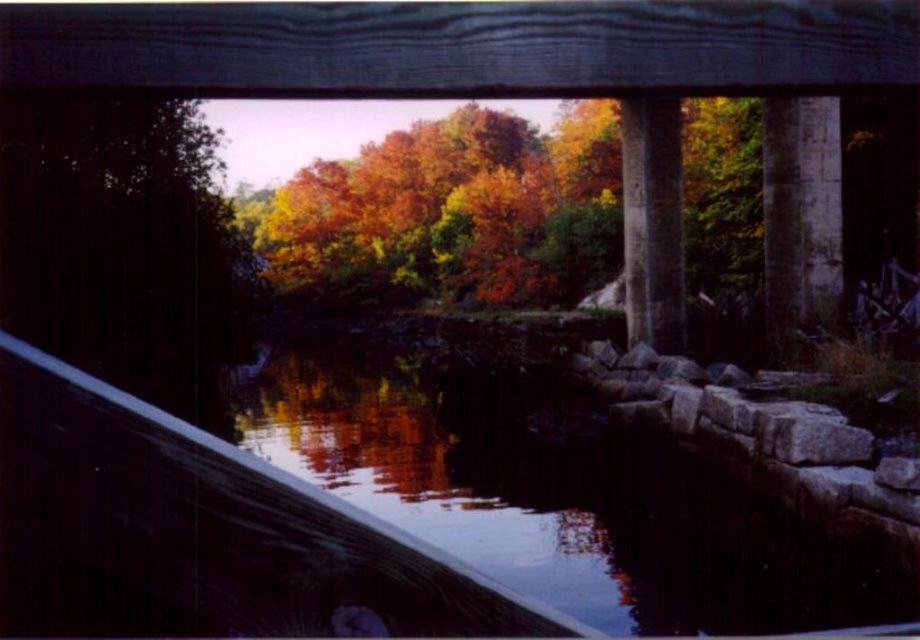
Is gray concrete pillar at right to the right of gray concrete pillar at center-right from the viewer's perspective?

Indeed, gray concrete pillar at right is positioned on the right side of gray concrete pillar at center-right.

Does gray concrete pillar at right have a lesser height compared to gray concrete pillar at center-right?

Yes, gray concrete pillar at right is shorter than gray concrete pillar at center-right.

Who is more forward, (820, 108) or (635, 104)?

Point (820, 108)

The width and height of the screenshot is (920, 640). In order to click on gray concrete pillar at right in this screenshot , I will do `click(800, 214)`.

Does point (628, 468) lie in front of point (818, 163)?

Yes, it is in front of point (818, 163).

Measure the distance between point (474,396) and camera.

27.33 meters

Locate an element on the screen. Image resolution: width=920 pixels, height=640 pixels. smooth stone river at center is located at coordinates (558, 500).

Can you confirm if smooth stone river at center is taller than gray concrete pillar at center-right?

No, smooth stone river at center is not taller than gray concrete pillar at center-right.

Is smooth stone river at center to the right of gray concrete pillar at center-right from the viewer's perspective?

In fact, smooth stone river at center is to the left of gray concrete pillar at center-right.

What are the coordinates of `smooth stone river at center` in the screenshot? It's located at pos(558,500).